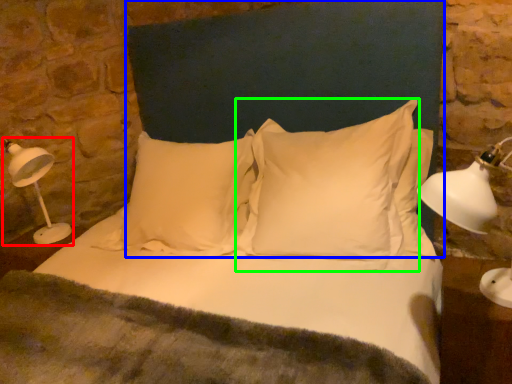
Question: Which is farther away from table lamp (highlighted by a red box)? headboard (highlighted by a blue box) or pillow (highlighted by a green box)?

Choices:
 (A) headboard
 (B) pillow

Answer: (B)